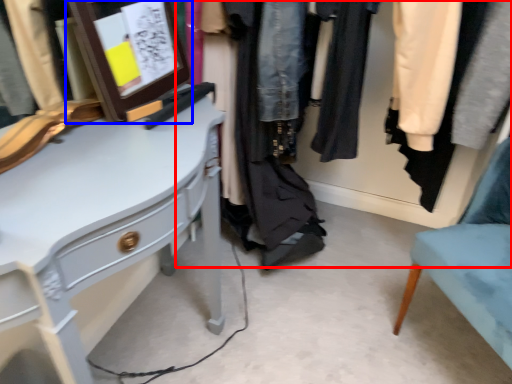
Question: Which point is further to the camera, closet (highlighted by a red box) or picture frame (highlighted by a blue box)?

Choices:
 (A) closet
 (B) picture frame

Answer: (A)